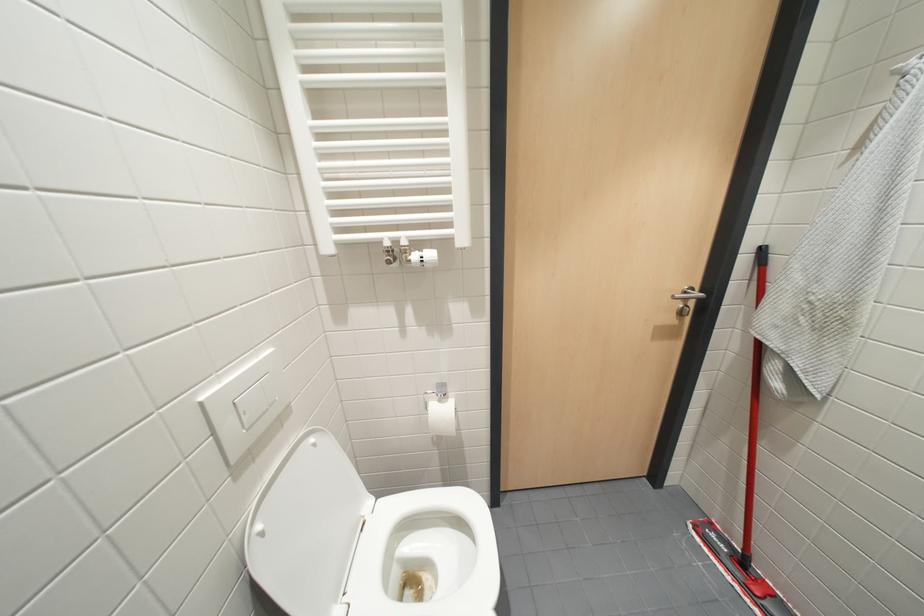
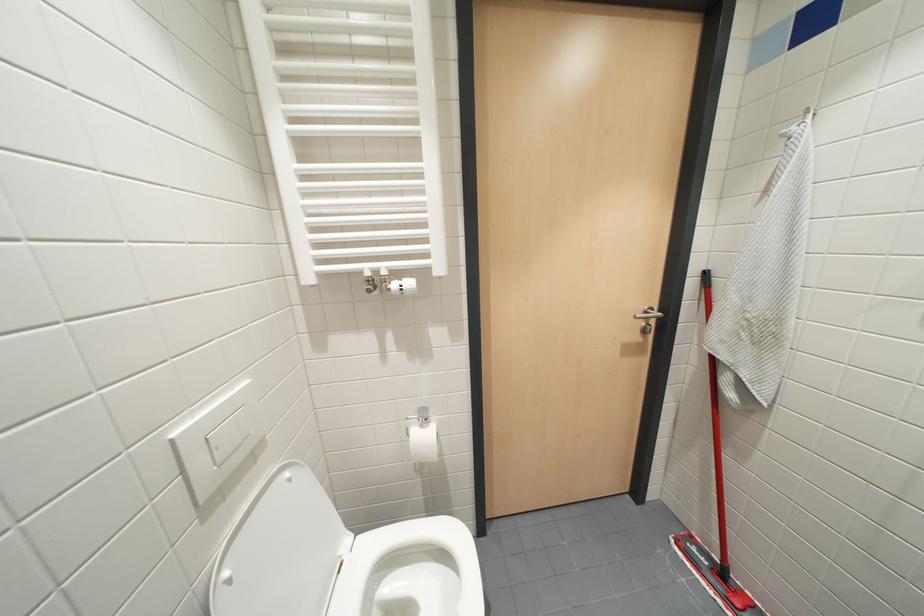
What movement of the cameraman would produce the second image?

The cameraman walked toward right, backward.